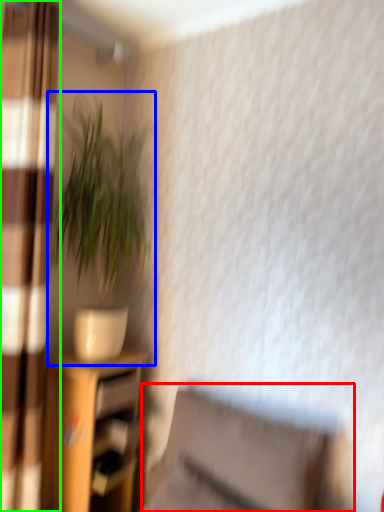
Question: Which object is positioned closest to swivel chair (highlighted by a red box)? Select from houseplant (highlighted by a blue box) and curtain (highlighted by a green box).

Choices:
 (A) houseplant
 (B) curtain

Answer: (B)